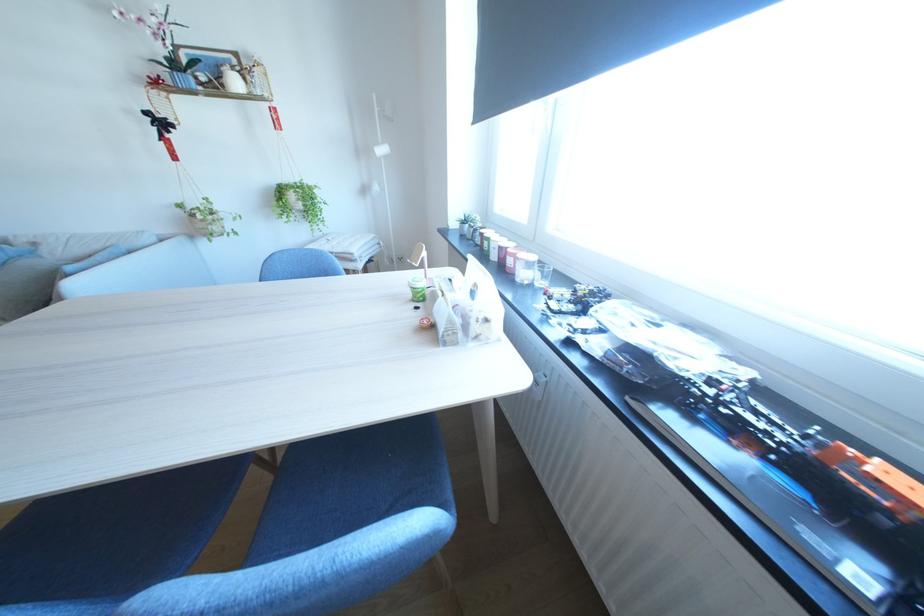
Where would you drink the clear drinking glass? Please return your answer as a coordinate pair (x, y).

(541, 275)